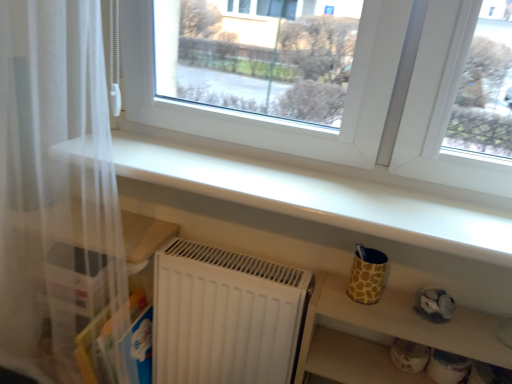
Question: Is white sheer curtain at left at the right side of matte yellow cup at lower right, which is the 2th shelf from top to bottom?

Choices:
 (A) no
 (B) yes

Answer: (A)

Question: Could matte yellow cup at lower right, the 1th shelf ordered from the bottom, be considered to be inside white sheer curtain at left?

Choices:
 (A) yes
 (B) no

Answer: (B)

Question: Is the depth of white sheer curtain at left greater than that of matte yellow cup at lower right, which is the 2th shelf from top to bottom?

Choices:
 (A) no
 (B) yes

Answer: (A)

Question: Is white sheer curtain at left oriented towards matte yellow cup at lower right, the 1th shelf ordered from the bottom?

Choices:
 (A) no
 (B) yes

Answer: (A)

Question: Is white sheer curtain at left bigger than matte yellow cup at lower right, the 1th shelf ordered from the bottom?

Choices:
 (A) yes
 (B) no

Answer: (A)

Question: From the image's perspective, relative to white sheer curtain at left, is white glossy shelf at upper center, the 1th shelf in the top-to-bottom sequence, above or below?

Choices:
 (A) below
 (B) above

Answer: (B)

Question: In terms of width, does white glossy shelf at upper center, which appears as the 2th shelf when ordered from the bottom, look wider or thinner when compared to white sheer curtain at left?

Choices:
 (A) thin
 (B) wide

Answer: (B)

Question: Considering their positions, is white glossy shelf at upper center, the 1th shelf in the top-to-bottom sequence, located in front of or behind white sheer curtain at left?

Choices:
 (A) behind
 (B) front

Answer: (B)

Question: Looking at the image, does white glossy shelf at upper center, the 1th shelf in the top-to-bottom sequence, seem bigger or smaller compared to white sheer curtain at left?

Choices:
 (A) small
 (B) big

Answer: (A)

Question: Would you say white sheer curtain at left is inside or outside matte yellow cup at lower right, the 1th shelf ordered from the bottom?

Choices:
 (A) outside
 (B) inside

Answer: (A)

Question: Is white sheer curtain at left in front of or behind matte yellow cup at lower right, the 1th shelf ordered from the bottom, in the image?

Choices:
 (A) front
 (B) behind

Answer: (A)

Question: Is white sheer curtain at left to the left or to the right of matte yellow cup at lower right, the 1th shelf ordered from the bottom, in the image?

Choices:
 (A) right
 (B) left

Answer: (B)

Question: Is white sheer curtain at left wider or thinner than matte yellow cup at lower right, the 1th shelf ordered from the bottom?

Choices:
 (A) thin
 (B) wide

Answer: (B)

Question: Visually, is matte yellow cup at lower right, the 1th shelf ordered from the bottom, positioned to the left or to the right of white sheer curtain at left?

Choices:
 (A) left
 (B) right

Answer: (B)

Question: Is point (340, 284) positioned closer to the camera than point (15, 102)?

Choices:
 (A) farther
 (B) closer

Answer: (A)